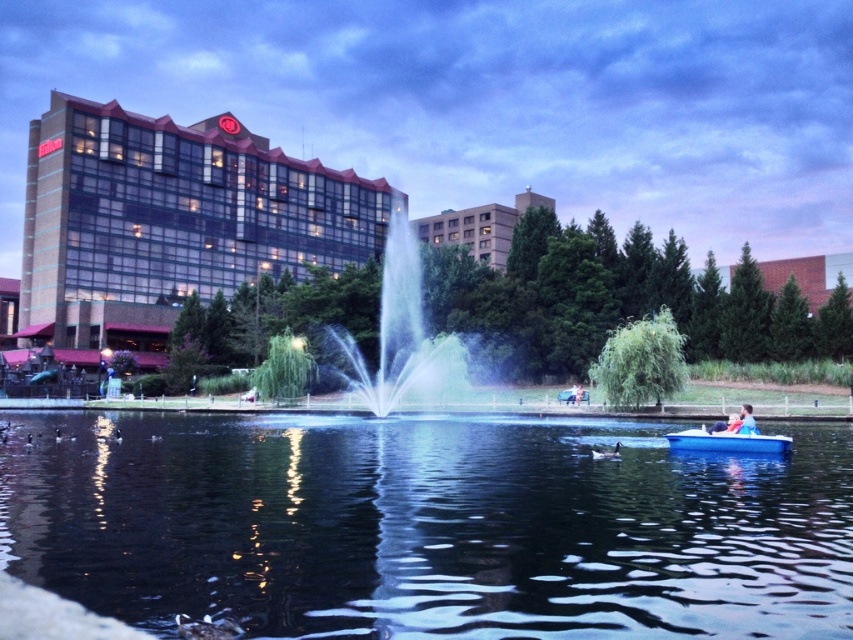
You are standing at the edge of the lake in the park and want to take a photo of the fountain. The transparent water at center is reflecting the sky. Where should you position yourself to capture the reflection clearly?

You should position yourself at the edge of the lake near the transparent water at center located at point (428,525) to capture the reflection clearly since that is where the water is transparent and reflecting the sky.